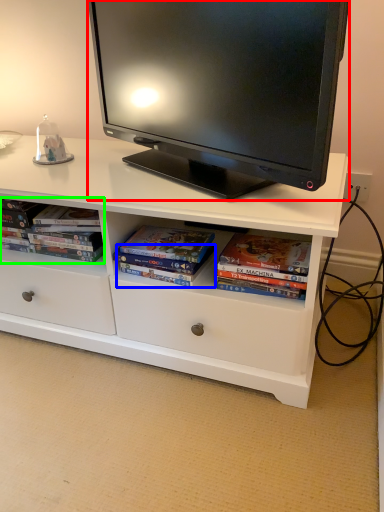
Question: Estimate the real-world distances between objects in this image. Which object is farther from television (highlighted by a red box), paperback book (highlighted by a blue box) or book (highlighted by a green box)?

Choices:
 (A) paperback book
 (B) book

Answer: (A)